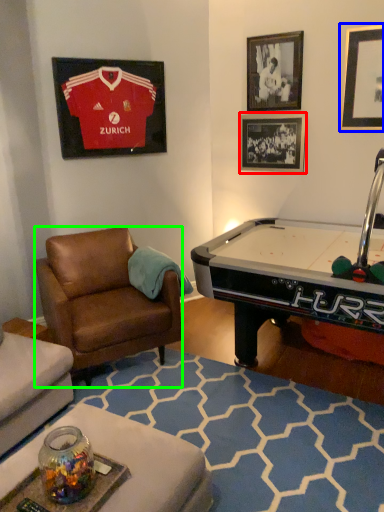
Question: Which is nearer to the picture frame (highlighted by a red box)? picture frame (highlighted by a blue box) or chair (highlighted by a green box).

Choices:
 (A) picture frame
 (B) chair

Answer: (A)